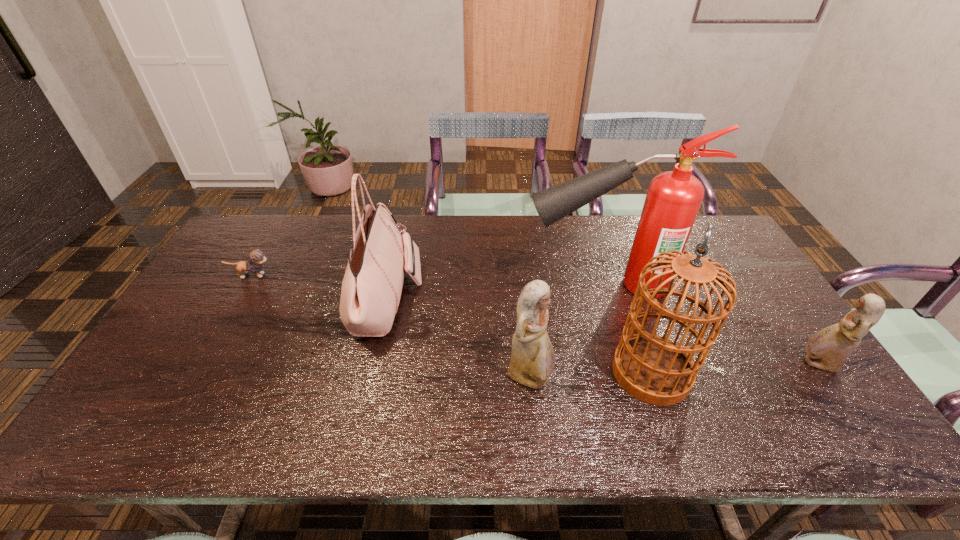
Where is `vacant space located 0.220m on the front-facing side of the shorter figurine`? The width and height of the screenshot is (960, 540). vacant space located 0.220m on the front-facing side of the shorter figurine is located at coordinates (713, 364).

Find the location of a particular element. The height and width of the screenshot is (540, 960). vacant region located 0.310m on the front-facing side of the shorter figurine is located at coordinates (679, 364).

This screenshot has width=960, height=540. What are the coordinates of `vacant space located 0.310m on the front-facing side of the shorter figurine` in the screenshot? It's located at (679, 364).

Where is `free space located on the side of the handbag with the attached pouch`? Image resolution: width=960 pixels, height=540 pixels. free space located on the side of the handbag with the attached pouch is located at coordinates 504,299.

The height and width of the screenshot is (540, 960). Find the location of `vacant space situated 0.160m on the front-facing side of the leftmost object`. vacant space situated 0.160m on the front-facing side of the leftmost object is located at coordinates (325, 275).

Identify the location of free space located at the nozzle of the fire extinguisher. The image size is (960, 540). (432, 285).

The width and height of the screenshot is (960, 540). I want to click on free location located at the nozzle of the fire extinguisher, so click(465, 285).

You are a GUI agent. You are given a task and a screenshot of the screen. Output one action in this format:
    pyautogui.click(x=<x>, y=<y>)
    Task: Click on the free point located at the nozzle of the fire extinguisher
    The width and height of the screenshot is (960, 540).
    Given the screenshot: What is the action you would take?
    pyautogui.click(x=478, y=285)

Locate an element on the screen. free space located 0.210m on the left of the birdcage is located at coordinates (530, 372).

Locate an element on the screen. The width and height of the screenshot is (960, 540). object present at the far edge is located at coordinates (371, 290).